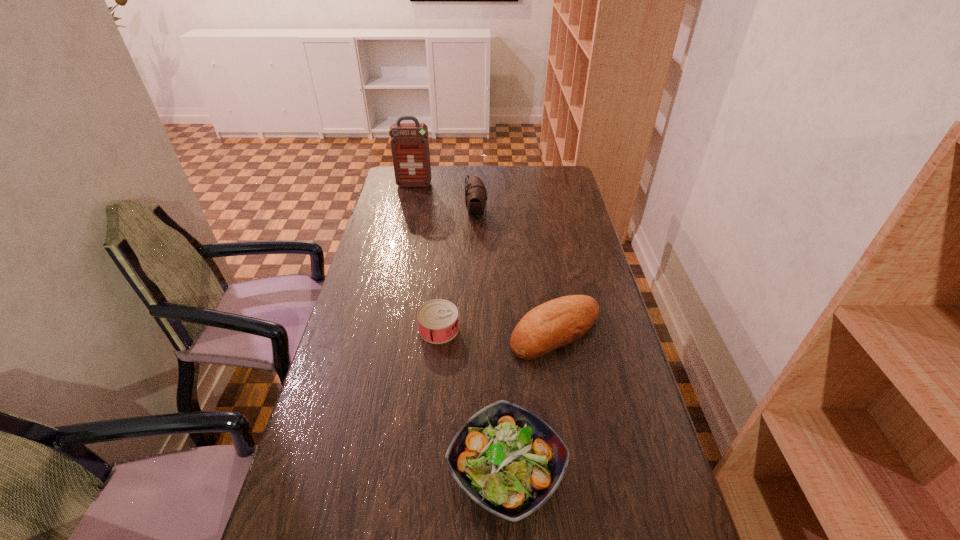
Find the location of a particular element. The height and width of the screenshot is (540, 960). vacant space in between the farthest object and the second tallest object is located at coordinates [x=445, y=199].

Where is `vacant area between the farthest object and the pouch`? The width and height of the screenshot is (960, 540). vacant area between the farthest object and the pouch is located at coordinates (445, 199).

This screenshot has width=960, height=540. I want to click on free space between the bread and the can, so click(x=497, y=330).

Identify the location of vacant region between the bread and the salad plate. The image size is (960, 540). (531, 401).

Where is `vacant space in between the farthest object and the bread`? vacant space in between the farthest object and the bread is located at coordinates (485, 259).

The height and width of the screenshot is (540, 960). I want to click on free area in between the salad plate and the second farthest object, so (492, 342).

This screenshot has height=540, width=960. Identify the location of object that is the fourth closest to the bread. (409, 142).

Locate an element on the screen. object that stands as the third closest to the leftmost object is located at coordinates (561, 321).

Identify the location of blank area in the image that satisfies the following two spatial constraints: 1. on the front side of the can; 2. on the left side of the bread. The width and height of the screenshot is (960, 540). (439, 332).

At what (x,y) coordinates should I click in order to perform the action: click on free spot that satisfies the following two spatial constraints: 1. on the front-facing side of the bread; 2. on the left side of the farthest object. Please return your answer as a coordinate pair (x, y). This screenshot has width=960, height=540. Looking at the image, I should click on (381, 332).